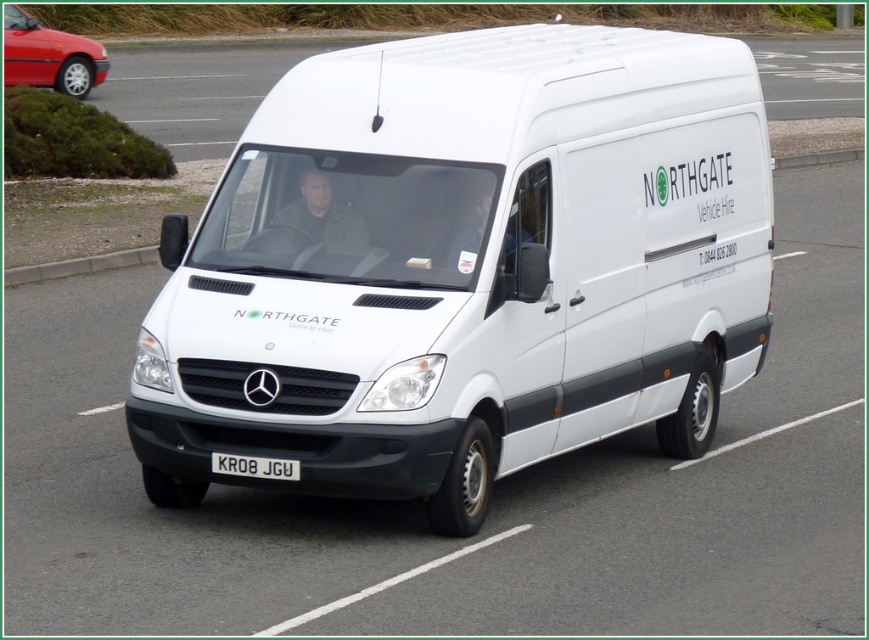
Which is more to the left, metallic red car at upper left or white metallic license plate at center?

From the viewer's perspective, metallic red car at upper left appears more on the left side.

From the picture: How distant is metallic red car at upper left from white metallic license plate at center?

metallic red car at upper left and white metallic license plate at center are 60.94 feet apart from each other.

Does point (58, 35) come farther from viewer compared to point (237, 470)?

Yes, it is.

Where is `metallic red car at upper left`? metallic red car at upper left is located at coordinates (50, 54).

Between metallic red car at upper left and gray concrete curb at lower left, which one is positioned higher?

metallic red car at upper left is above.

Is metallic red car at upper left wider than gray concrete curb at lower left?

Yes.

Who is more distant from viewer, (7, 81) or (60, 260)?

The point (7, 81) is more distant.

You are a GUI agent. You are given a task and a screenshot of the screen. Output one action in this format:
    pyautogui.click(x=<x>, y=<y>)
    Task: Click on the metallic red car at upper left
    Image resolution: width=869 pixels, height=640 pixels.
    Given the screenshot: What is the action you would take?
    pyautogui.click(x=50, y=54)

Does white matte van at center appear over white metallic license plate at center?

Indeed, white matte van at center is positioned over white metallic license plate at center.

Who is more distant from viewer, (280,237) or (267,458)?

The point (280,237) is more distant.

Identify the location of white matte van at center. (463, 266).